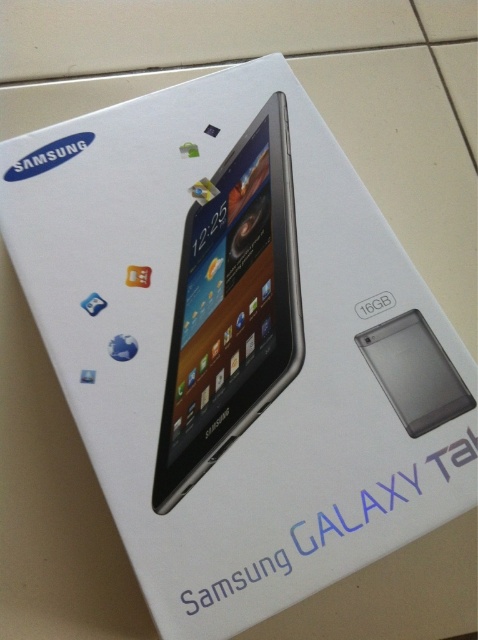
What is the exact coordinate position of the silver metallic tablet at center in the image?

The silver metallic tablet at center is located at point (231, 307).

You are trying to decide which device to carry in your bag. Both the silver metallic tablet at center and the transparent plastic smartphone at center are on the packaging box. Which device is wider?

The silver metallic tablet at center is wider than the transparent plastic smartphone at center.

You are trying to determine the position of the silver metallic tablet at center and the transparent plastic smartphone at center on the packaging box. Based on the scene description, which one is placed higher up?

The silver metallic tablet at center is placed higher up because it is above the transparent plastic smartphone at center according to the description.